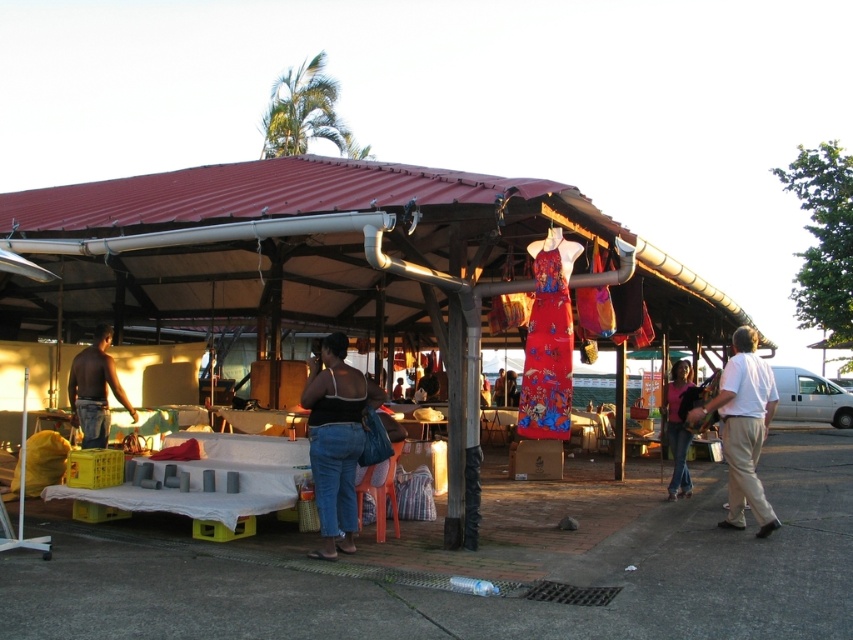
Question: Which of the following is the farthest from the observer?

Choices:
 (A) (728, 429)
 (B) (309, 371)
 (C) (689, 384)
 (D) (61, 216)

Answer: (B)

Question: Which point appears farthest from the camera in this image?

Choices:
 (A) (730, 433)
 (B) (320, 493)
 (C) (677, 483)
 (D) (96, 365)

Answer: (C)

Question: Which of the following is the closest to the observer?

Choices:
 (A) (688, 369)
 (B) (721, 374)
 (C) (335, 525)

Answer: (C)

Question: Where is matte plastic dress at center located in relation to black fabric dress at center in the image?

Choices:
 (A) right
 (B) left

Answer: (A)

Question: Does shiny black skin at left have a lesser width compared to pink fabric dress at lower right?

Choices:
 (A) no
 (B) yes

Answer: (A)

Question: Considering the relative positions of black fabric dress at center and white cotton shirt at right in the image provided, where is black fabric dress at center located with respect to white cotton shirt at right?

Choices:
 (A) above
 (B) below

Answer: (B)